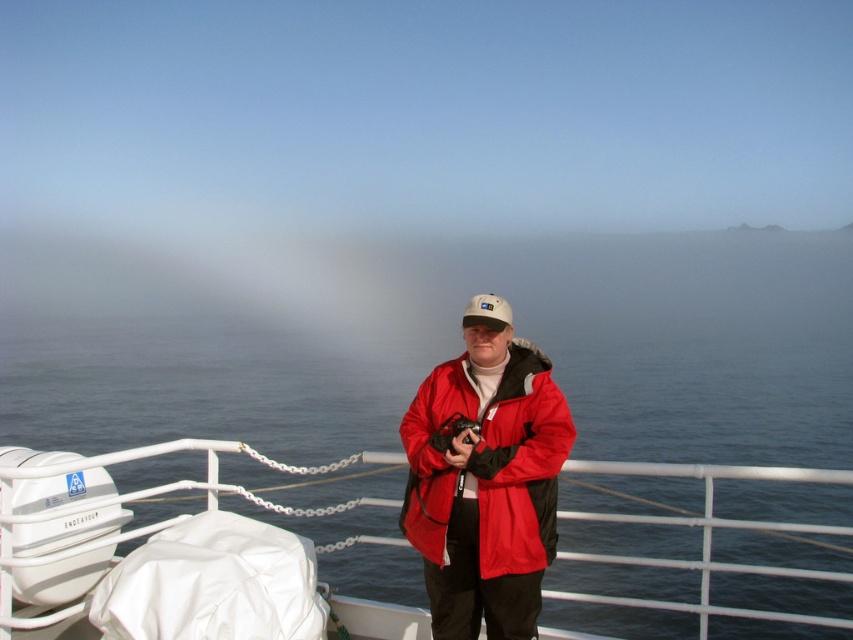
Does red matte jacket at center have a smaller size compared to white matte boat at center?

Yes, red matte jacket at center is smaller than white matte boat at center.

Can you confirm if red matte jacket at center is taller than white matte boat at center?

No, red matte jacket at center is not taller than white matte boat at center.

Is point (410, 476) farther from camera compared to point (772, 468)?

No, (410, 476) is closer to viewer.

Identify the location of red matte jacket at center. (489, 461).

Can you confirm if white matte boat at center is taller than white fabric cap at center?

Indeed, white matte boat at center has a greater height compared to white fabric cap at center.

Does white matte boat at center have a smaller size compared to white fabric cap at center?

No, white matte boat at center is not smaller than white fabric cap at center.

Who is more distant from viewer, (x=619, y=520) or (x=474, y=321)?

The point (x=619, y=520) is more distant.

I want to click on white matte boat at center, so click(706, 536).

How distant is red matte jacket at center from white fabric cap at center?

red matte jacket at center is 38.47 inches away from white fabric cap at center.

Does point (512, 563) come in front of point (498, 314)?

Yes.

Identify the location of red matte jacket at center. (489, 461).